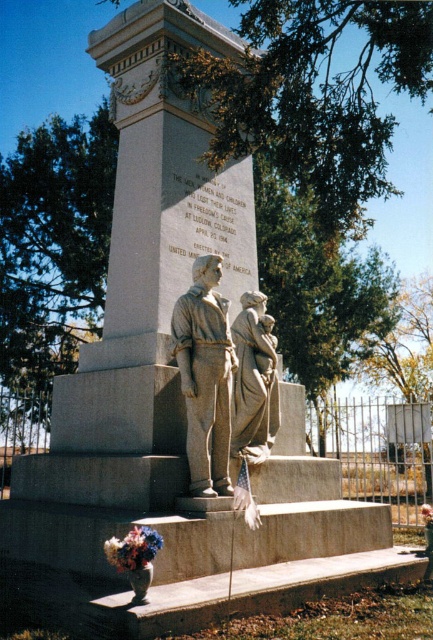
Consider the image. You are a photographer standing in front of the monument. You want to take a photo where both points, point (188, 397) and point (144, 564), are clearly visible. Based on their positions, which point will appear closer to the top of the photo?

Point (188, 397) is further to the camera than point (144, 564). Therefore, in the photo, point (188, 397) will appear closer to the top of the photo since it is nearer to the camera.

You are a photographer planning to take a photo of the matte gray stone sculpture at center and the fluffy bouquet at lower left. Since you want to ensure both are clearly visible, which object should you focus on first to avoid blurring due to size differences?

The matte gray stone sculpture at center is bigger than the fluffy bouquet at lower left, so you should focus on the matte gray stone sculpture at center first to ensure proper focus on the larger object before adjusting for the smaller one.